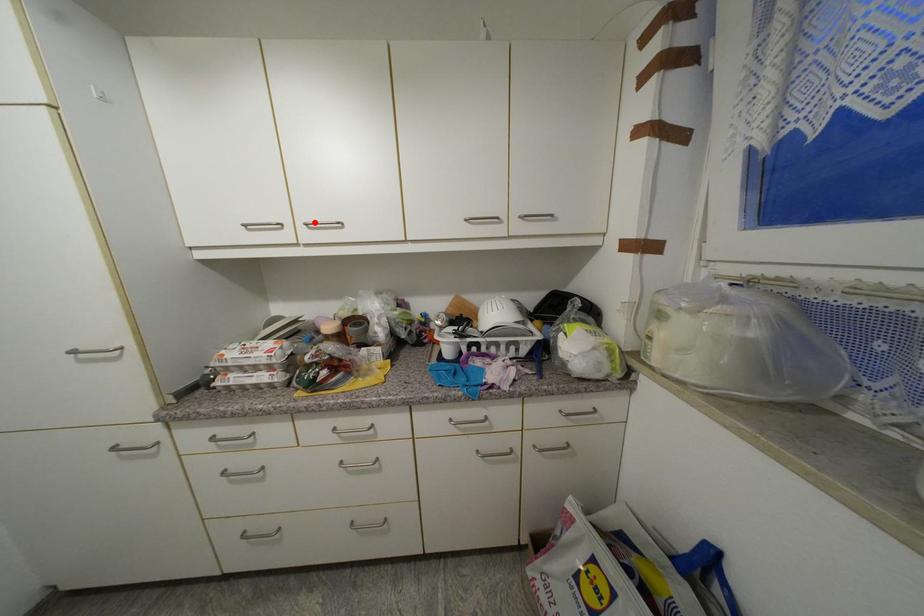
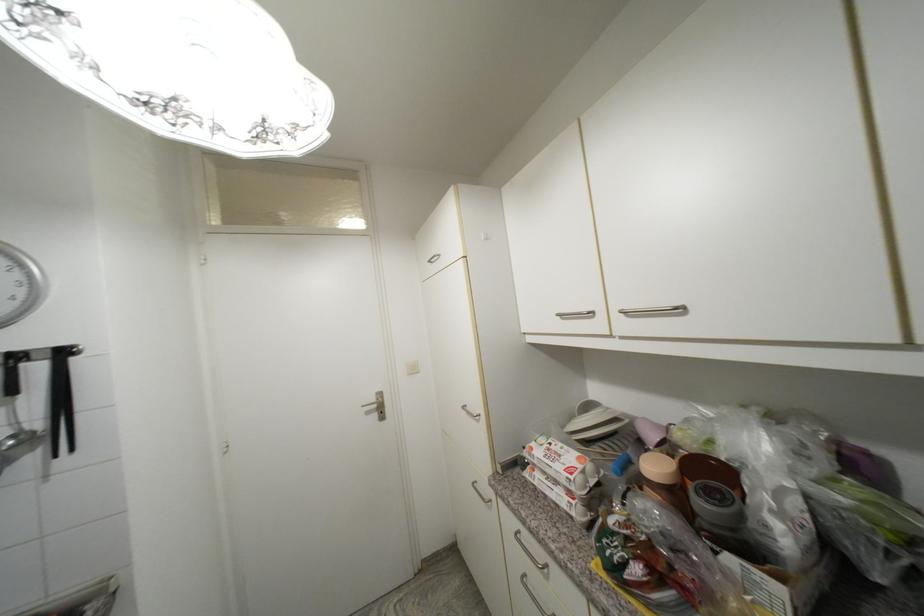
In the second image, find the point that corresponds to the highlighted location in the first image.

(631, 309)